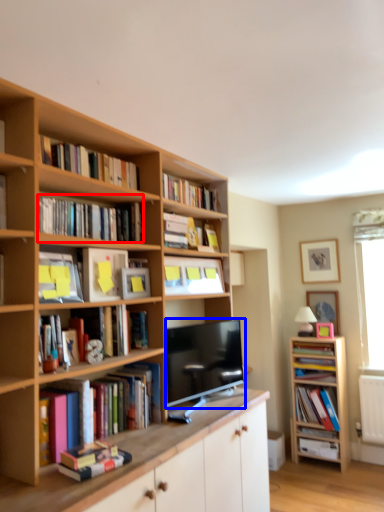
Question: Which object appears closest to the camera in this image, book (highlighted by a red box) or television (highlighted by a blue box)?

Choices:
 (A) book
 (B) television

Answer: (A)